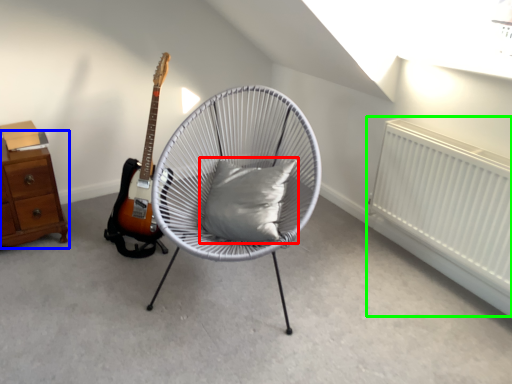
Question: Estimate the real-world distances between objects in this image. Which object is closer to pillow (highlighted by a red box), chest of drawers (highlighted by a blue box) or radiator (highlighted by a green box)?

Choices:
 (A) chest of drawers
 (B) radiator

Answer: (B)